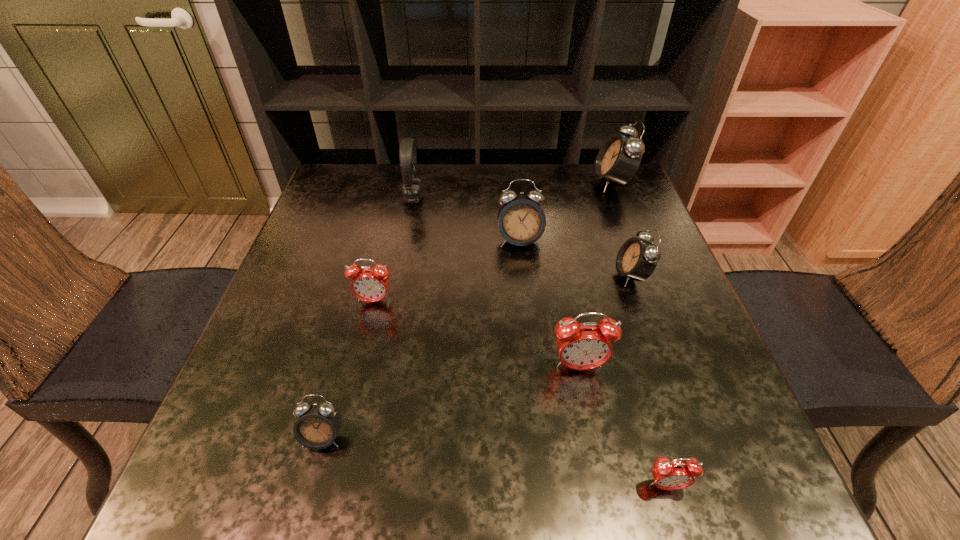
Locate which alarm clock is the closest to the farthest red alarm clock. Please provide its 2D coordinates. Your answer should be formatted as a tuple, i.e. [(x, y)], where the tuple contains the x and y coordinates of a point satisfying the conditions above.

[(318, 423)]

Where is `the closest white alarm clock relative to the second red alarm clock from right to left`? The image size is (960, 540). the closest white alarm clock relative to the second red alarm clock from right to left is located at coordinates (637, 259).

Select which white alarm clock appears as the third closest to the headset. Please provide its 2D coordinates. Your answer should be formatted as a tuple, i.e. [(x, y)], where the tuple contains the x and y coordinates of a point satisfying the conditions above.

[(637, 259)]

Identify the location of the closest red alarm clock to the leftmost red alarm clock. pos(581,346).

Locate an element on the screen. Image resolution: width=960 pixels, height=540 pixels. the second closest red alarm clock to the third nearest object is located at coordinates (368, 284).

At what (x,y) coordinates should I click in order to perform the action: click on free spot that satisfies the following two spatial constraints: 1. on the face of the second nearest white alarm clock; 2. on the face of the nearest red alarm clock. Please return your answer as a coordinate pair (x, y). Looking at the image, I should click on (707, 485).